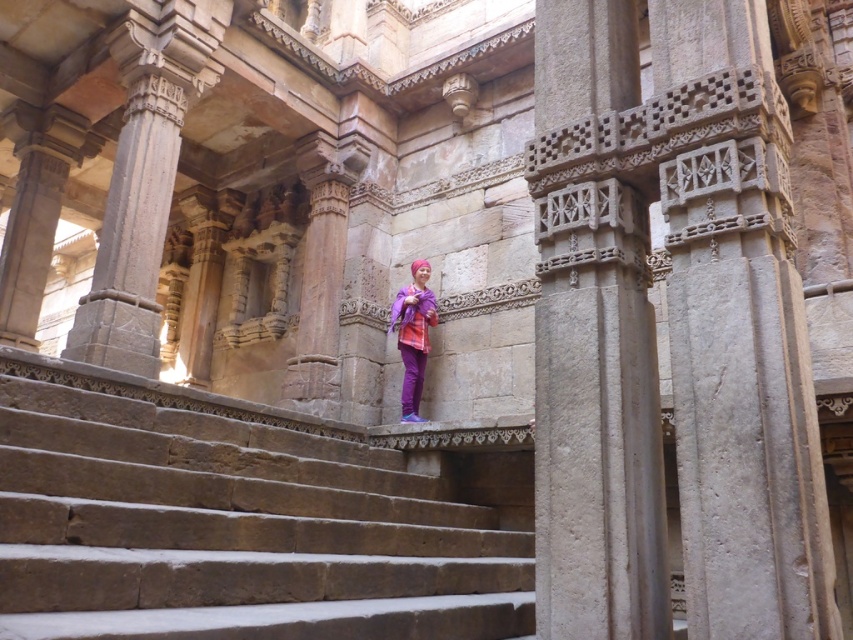
Is brown stone stairs at center thinner than purple fabric at center?

In fact, brown stone stairs at center might be wider than purple fabric at center.

Is point (225, 458) more distant than point (415, 301)?

No, (225, 458) is in front of (415, 301).

At what (x,y) coordinates should I click in order to perform the action: click on brown stone stairs at center. Please return your answer as a coordinate pair (x, y). This screenshot has height=640, width=853. Looking at the image, I should click on (233, 529).

In the scene shown: Between purple fabric at center and purple matte sweatshirt at center, which one has more height?

purple fabric at center is taller.

Does purple fabric at center have a smaller size compared to purple matte sweatshirt at center?

No, purple fabric at center is not smaller than purple matte sweatshirt at center.

Measure the distance between purple fabric at center and camera.

A distance of 38.57 feet exists between purple fabric at center and camera.

Where is `purple fabric at center`? purple fabric at center is located at coordinates (413, 336).

Is brown stone stairs at center positioned before purple matte sweatshirt at center?

Yes, brown stone stairs at center is in front of purple matte sweatshirt at center.

What do you see at coordinates (233, 529) in the screenshot? I see `brown stone stairs at center` at bounding box center [233, 529].

Image resolution: width=853 pixels, height=640 pixels. What are the coordinates of `brown stone stairs at center` in the screenshot? It's located at (233, 529).